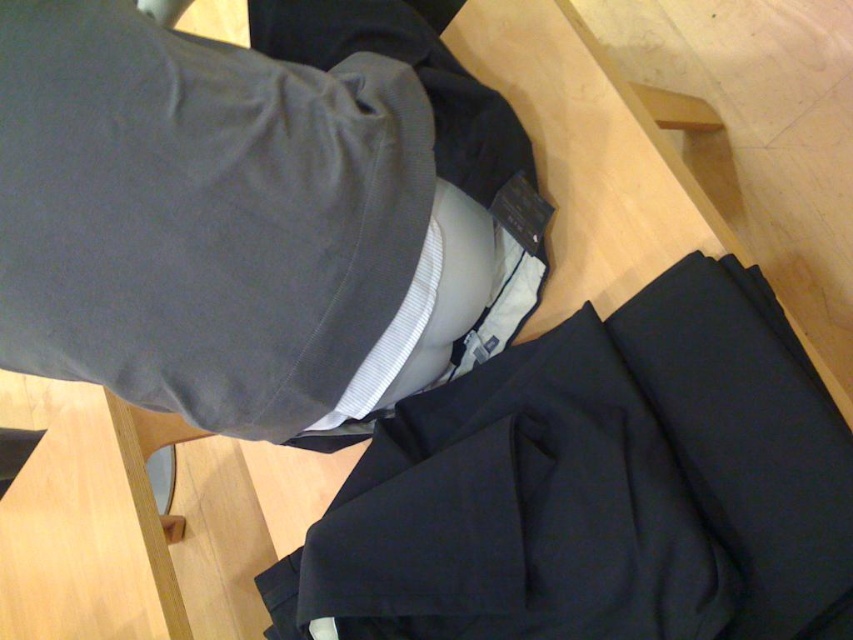
You are organizing clothes on a table and notice two points marked on the table surface. The first point is labeled as point (488, 605) and the second as point (215, 416). If you place an item at each point, which point will have an item that is partially hidden by the other?

The item placed at point (488, 605) will be partially hidden by the item at point (215, 416) because point (488, 605) is behind point (215, 416).

You are organizing a clothing store and need to arrange the navy blue fabric pants at center and the dark gray fabric jacket at upper center for a display. According to their current positions, which clothing item is placed to the right of the other?

The navy blue fabric pants at center is positioned on the right side of dark gray fabric jacket at upper center.

You are a tailor who needs to determine which clothing item takes up more horizontal space on the table. Based on the image, which one is wider between the navy blue fabric pants at center and the dark gray fabric jacket at upper center?

The navy blue fabric pants at center are wider than the dark gray fabric jacket at upper center according to the description provided.